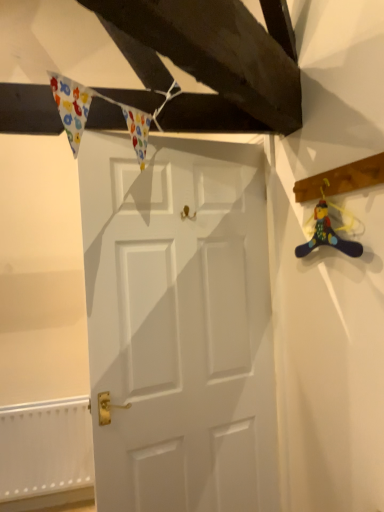
Question: In terms of height, does matte plastic toy at right look taller or shorter compared to white textured radiator at lower left?

Choices:
 (A) short
 (B) tall

Answer: (A)

Question: From a real-world perspective, relative to white textured radiator at lower left, is matte plastic toy at right vertically above or below?

Choices:
 (A) below
 (B) above

Answer: (B)

Question: Which is nearer to the white textured radiator at lower left?

Choices:
 (A) matte plastic toy at right
 (B) white matte door at center
 (C) wooden plank at upper right

Answer: (B)

Question: Which object is the closest to the white textured radiator at lower left?

Choices:
 (A) white matte door at center
 (B) matte plastic toy at right
 (C) wooden plank at upper right

Answer: (A)